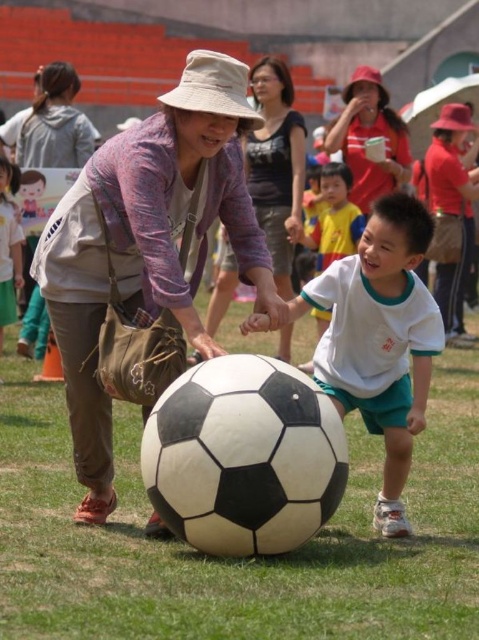
You are organizing a clothing rack for a store and need to place the matte purple sweater at center and the matte gray hoodie at upper left. According to the scene, which item is located to the right of the other?

The matte purple sweater at center is positioned on the right side of the matte gray hoodie at upper left.

You are a photographer trying to capture a photo of the white matte soccer ball at center and the matte red bucket hat at upper center. Which object should you focus on first if you want to ensure both are in the frame without moving the camera?

You should focus on the white matte soccer ball at center first because it is positioned on the left side of the matte red bucket hat at upper center, so by centering the soccer ball, the bucket hat will naturally be in the frame to its right.

You are a photographer standing at the edge of the soccer field. You want to take a photo that includes both the white matte soccer ball at center and the matte red bucket hat at upper center. If your camera can capture a maximum distance of 10 meters between the closest and farthest objects in focus, will both objects be in focus?

The distance between the white matte soccer ball at center and the matte red bucket hat at upper center is 9.35 meters, which is within the camera maximum focus range of 10 meters. Therefore, both objects will be in focus.